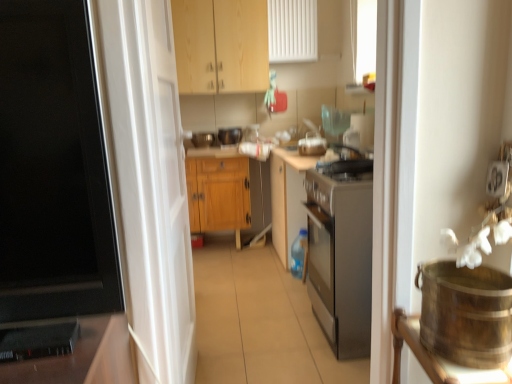
Question: From the image's perspective, is white glossy door at center located above or below wooden cabinet at center, acting as the 1th cabinetry starting from the bottom?

Choices:
 (A) below
 (B) above

Answer: (A)

Question: Considering their positions, is white glossy door at center located in front of or behind wooden cabinet at center, which is the second cabinetry in top-to-bottom order?

Choices:
 (A) front
 (B) behind

Answer: (A)

Question: Which is nearer to the wooden cabinet at center, which is the second cabinetry in top-to-bottom order?

Choices:
 (A) white glossy door at center
 (B) wooden cabinet at upper center, acting as the 2th cabinetry starting from the bottom
 (C) black plastic speaker at lower left

Answer: (B)

Question: Which of these objects is positioned closest to the wooden cabinet at upper center, arranged as the first cabinetry when viewed from the top?

Choices:
 (A) black plastic speaker at lower left
 (B) white glossy door at center
 (C) wooden cabinet at center, acting as the 1th cabinetry starting from the bottom

Answer: (C)